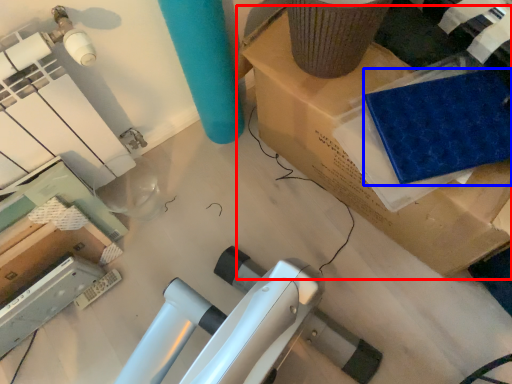
Question: Among these objects, which one is nearest to the camera, furniture (highlighted by a red box) or fabric (highlighted by a blue box)?

Choices:
 (A) furniture
 (B) fabric

Answer: (A)